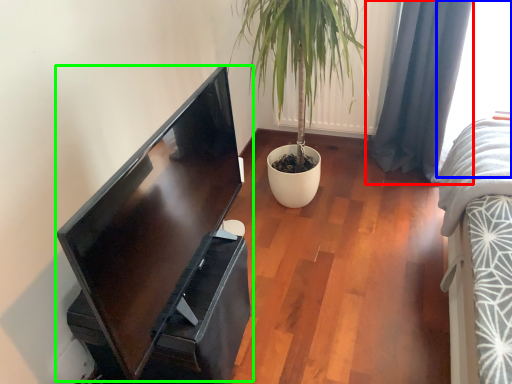
Question: Which object is positioned closest to curtain (highlighted by a red box)? Select from window (highlighted by a blue box) and computer monitor (highlighted by a green box).

Choices:
 (A) window
 (B) computer monitor

Answer: (A)